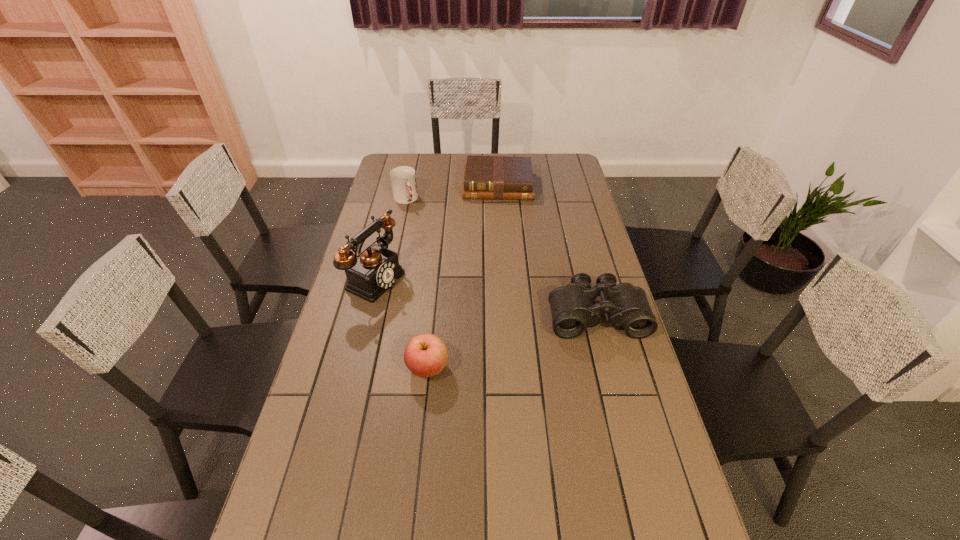
The height and width of the screenshot is (540, 960). Identify the location of vacant space that's between the binoculars and the Bible. (547, 250).

This screenshot has width=960, height=540. Find the location of `free area in between the binoculars and the cup`. free area in between the binoculars and the cup is located at coordinates (501, 257).

The image size is (960, 540). What are the coordinates of `free space between the binoculars and the shortest object` in the screenshot? It's located at (547, 250).

Locate which object ranks in proximity to the tallest object. Please provide its 2D coordinates. Your answer should be formatted as a tuple, i.e. [(x, y)], where the tuple contains the x and y coordinates of a point satisfying the conditions above.

[(425, 355)]

Where is `object that is the third nearest to the Bible`? This screenshot has width=960, height=540. object that is the third nearest to the Bible is located at coordinates (573, 308).

Where is `vacant space that satisfies the following two spatial constraints: 1. on the back side of the tallest object; 2. on the right side of the cup`? The image size is (960, 540). vacant space that satisfies the following two spatial constraints: 1. on the back side of the tallest object; 2. on the right side of the cup is located at coordinates (396, 200).

Find the location of a particular element. The image size is (960, 540). vacant space that satisfies the following two spatial constraints: 1. on the back side of the telephone; 2. on the left side of the cup is located at coordinates (396, 200).